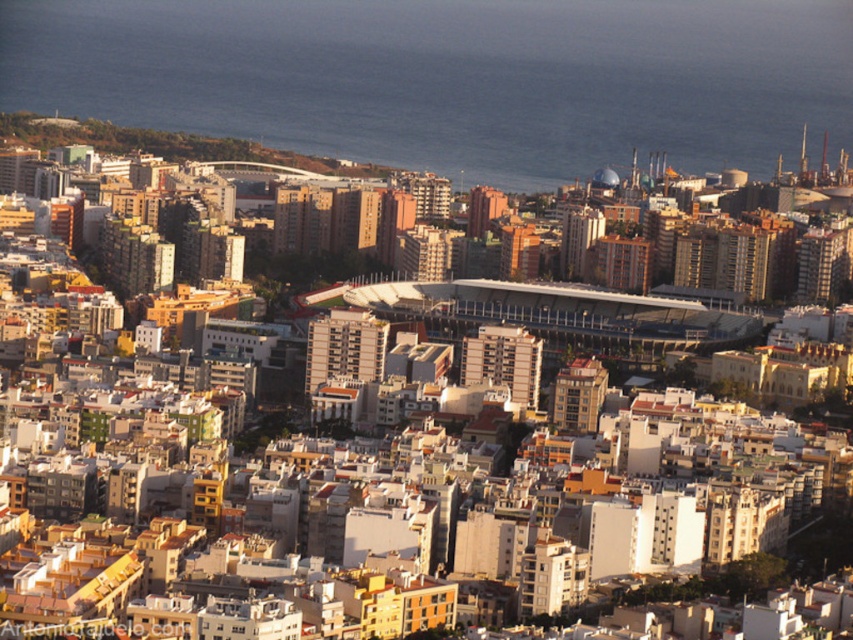
You are a drone operator flying a drone over the city. Your drone is currently at point A, which is at coordinates point (720, 58), and you need to fly it to point B, which is at coordinates point (596, 172). However, there is a restricted area between these two points. Based on the image, can you determine if the restricted area is between the two points or behind point B?

Point (720, 58) is behind point (596, 172), so the restricted area is behind point B.

You are a pilot flying over the city and need to identify landmarks. Based on the scene, which of the two landmarks, the blue water at center or the matte white dome at center, appears taller from your aerial view?

The blue water at center appears taller than the matte white dome at center from the aerial view.